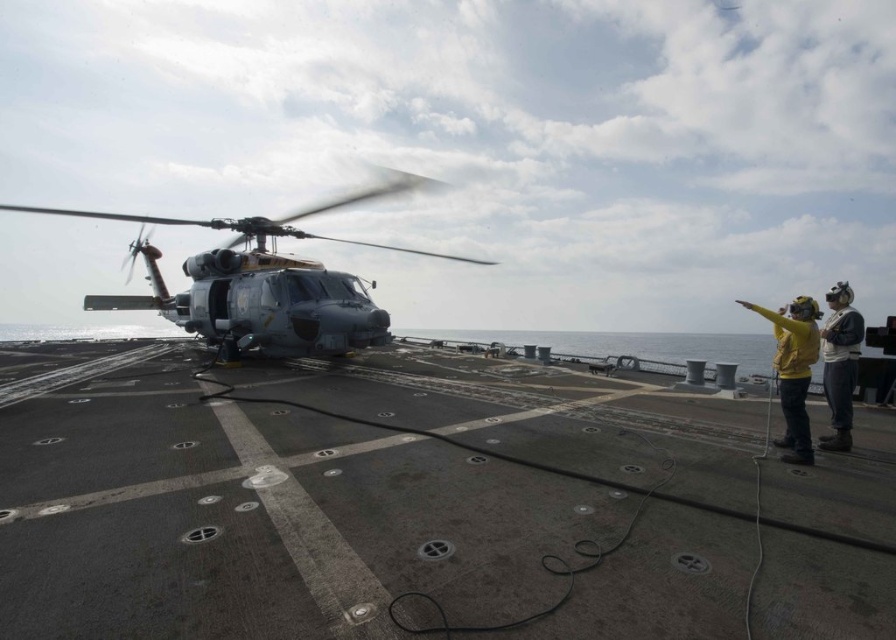
You are a crew member on the naval ship deck. You need to retrieve the yellow fabric jacket at right but must avoid the metallic gray helicopter at center. Which direction should you move to reach the jacket without going near the helicopter?

The metallic gray helicopter at center is to the left of the yellow fabric jacket at right, so you should move towards the right side of the deck away from the helicopter to reach the jacket safely.

You are a drone operator controlling a drone that needs to land on the naval ship deck. The drone has a 2 meter wingspan. The deck has a black cable running across it. Where should you avoid placing the drone to ensure it doesn not interfere with the metallic gray helicopter at center represented by point (265, 282)?

You should avoid placing the drone near the metallic gray helicopter at center represented by point (265, 282) because the helicopter is in the center of the deck and its rotor blades are in motion, indicating it might be preparing for takeoff or has just landed. The black cable running across the deck might also pose a hazard if the drone lands on it.